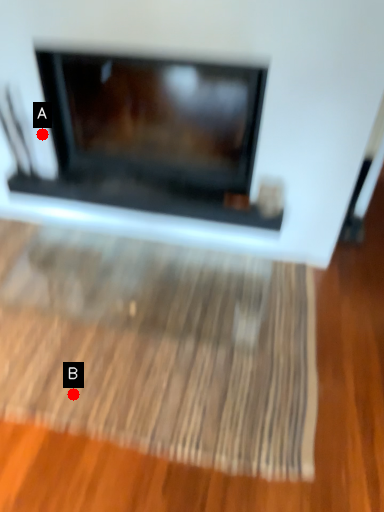
Question: Two points are circled on the image, labeled by A and B beside each circle. Among these points, which one is farthest from the camera?

Choices:
 (A) A is further
 (B) B is further

Answer: (A)